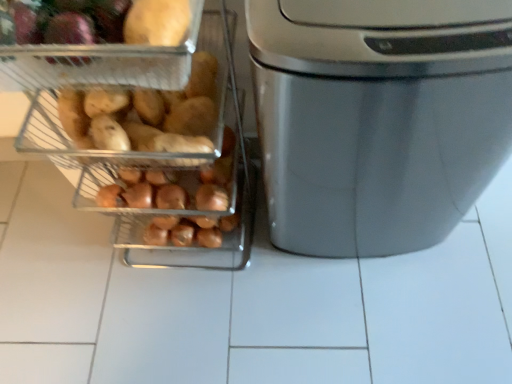
Question: Does matte brown sweet potato at left have a greater width compared to metallic silver trash can at right?

Choices:
 (A) yes
 (B) no

Answer: (B)

Question: Can you confirm if matte brown sweet potato at left is smaller than metallic silver trash can at right?

Choices:
 (A) no
 (B) yes

Answer: (B)

Question: Can you confirm if matte brown sweet potato at left is thinner than metallic silver trash can at right?

Choices:
 (A) no
 (B) yes

Answer: (B)

Question: Is matte brown sweet potato at left facing away from metallic silver trash can at right?

Choices:
 (A) no
 (B) yes

Answer: (B)

Question: From a real-world perspective, is matte brown sweet potato at left physically below metallic silver trash can at right?

Choices:
 (A) yes
 (B) no

Answer: (B)

Question: From the image's perspective, is matte yellow potato at upper left located above or below matte brown sweet potato at left?

Choices:
 (A) above
 (B) below

Answer: (A)

Question: Based on their sizes in the image, would you say matte yellow potato at upper left is bigger or smaller than matte brown sweet potato at left?

Choices:
 (A) small
 (B) big

Answer: (B)

Question: Considering their positions, is matte yellow potato at upper left located in front of or behind matte brown sweet potato at left?

Choices:
 (A) behind
 (B) front

Answer: (B)

Question: Would you say matte yellow potato at upper left is to the left or to the right of matte brown sweet potato at left in the picture?

Choices:
 (A) left
 (B) right

Answer: (A)

Question: From a real-world perspective, is matte brown sweet potato at left above or below metallic silver trash can at right?

Choices:
 (A) above
 (B) below

Answer: (A)

Question: Based on their sizes in the image, would you say matte brown sweet potato at left is bigger or smaller than metallic silver trash can at right?

Choices:
 (A) big
 (B) small

Answer: (B)

Question: Considering the positions of matte brown sweet potato at left and metallic silver trash can at right in the image, is matte brown sweet potato at left taller or shorter than metallic silver trash can at right?

Choices:
 (A) short
 (B) tall

Answer: (A)

Question: Considering the positions of point (73, 132) and point (198, 211), is point (73, 132) closer or farther from the camera than point (198, 211)?

Choices:
 (A) closer
 (B) farther

Answer: (A)

Question: Choose the correct answer: Is satin silver trash can at right inside metallic silver trash can at right or outside it?

Choices:
 (A) inside
 (B) outside

Answer: (B)

Question: From a real-world perspective, is satin silver trash can at right physically located above or below metallic silver trash can at right?

Choices:
 (A) below
 (B) above

Answer: (A)